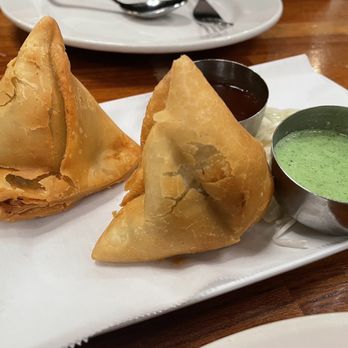
You are a GUI agent. You are given a task and a screenshot of the screen. Output one action in this format:
    pyautogui.click(x=<x>, y=<y>)
    Task: Click on the metal sauce bowls
    
    Given the screenshot: What is the action you would take?
    pyautogui.click(x=237, y=70), pyautogui.click(x=300, y=206)